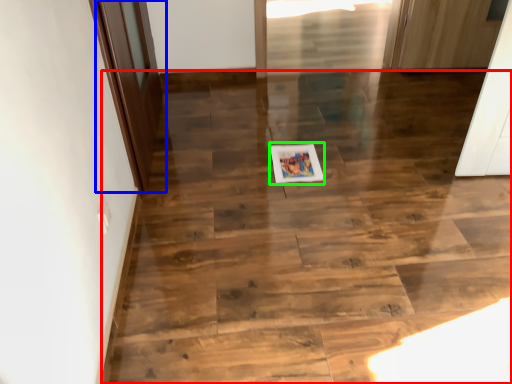
Question: Estimate the real-world distances between objects in this image. Which object is closer to stairwell (highlighted by a red box), door (highlighted by a blue box) or postcard (highlighted by a green box)?

Choices:
 (A) door
 (B) postcard

Answer: (B)